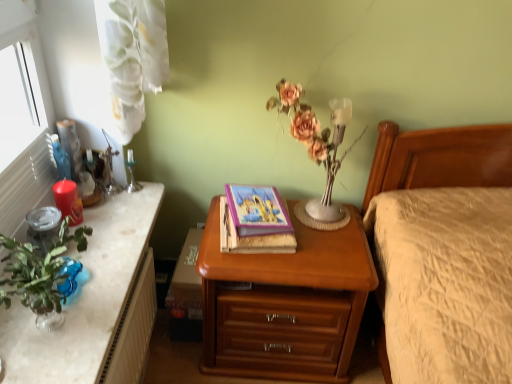
Locate an element on the screen. The image size is (512, 384). vacant area on top of wooden nightstand at center (from a real-world perspective) is located at coordinates [306, 238].